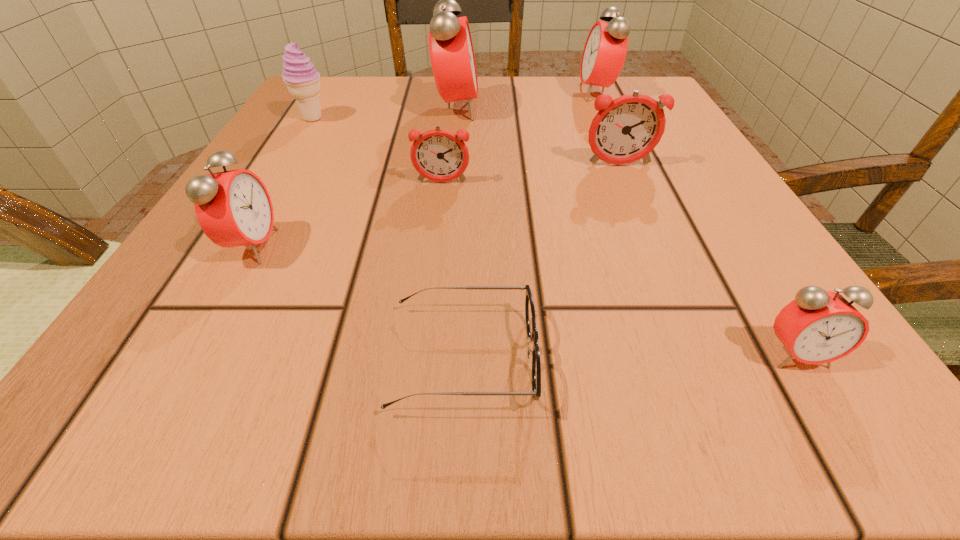
Locate an element on the screen. Image resolution: width=960 pixels, height=540 pixels. the biggest red alarm clock is located at coordinates (452, 57).

At what (x,y) coordinates should I click in order to perform the action: click on the tallest object. Please return your answer as a coordinate pair (x, y). Looking at the image, I should click on (452, 57).

Locate an element on the screen. the second tallest alarm clock is located at coordinates (604, 54).

The height and width of the screenshot is (540, 960). In order to click on the third red alarm clock from left to right in this screenshot , I will do click(x=604, y=54).

Find the location of a particular element. Image resolution: width=960 pixels, height=540 pixels. icecream is located at coordinates (302, 80).

Where is `the fourth farthest object`? the fourth farthest object is located at coordinates (626, 129).

At what (x,y) coordinates should I click in order to perform the action: click on the farther reddish-pink alarm clock. Please return your answer as a coordinate pair (x, y). Looking at the image, I should click on (626, 129).

Image resolution: width=960 pixels, height=540 pixels. In order to click on the third nearest object in this screenshot , I will do (x=233, y=208).

You are a GUI agent. You are given a task and a screenshot of the screen. Output one action in this format:
    pyautogui.click(x=<x>, y=<y>)
    Task: Click on the second nearest red alarm clock
    The height and width of the screenshot is (540, 960).
    Given the screenshot: What is the action you would take?
    pyautogui.click(x=233, y=208)

Locate an element on the screen. This screenshot has width=960, height=540. the fifth farthest object is located at coordinates (439, 155).